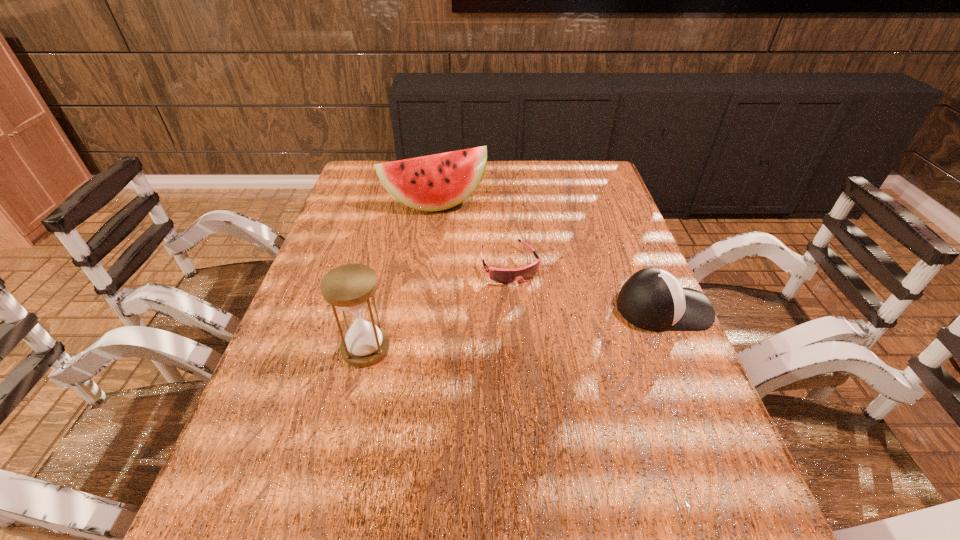
Where is `vacant space that satisfies the following two spatial constraints: 1. on the front side of the third tallest object; 2. on the front panel of the third nearest object`? vacant space that satisfies the following two spatial constraints: 1. on the front side of the third tallest object; 2. on the front panel of the third nearest object is located at coordinates (513, 308).